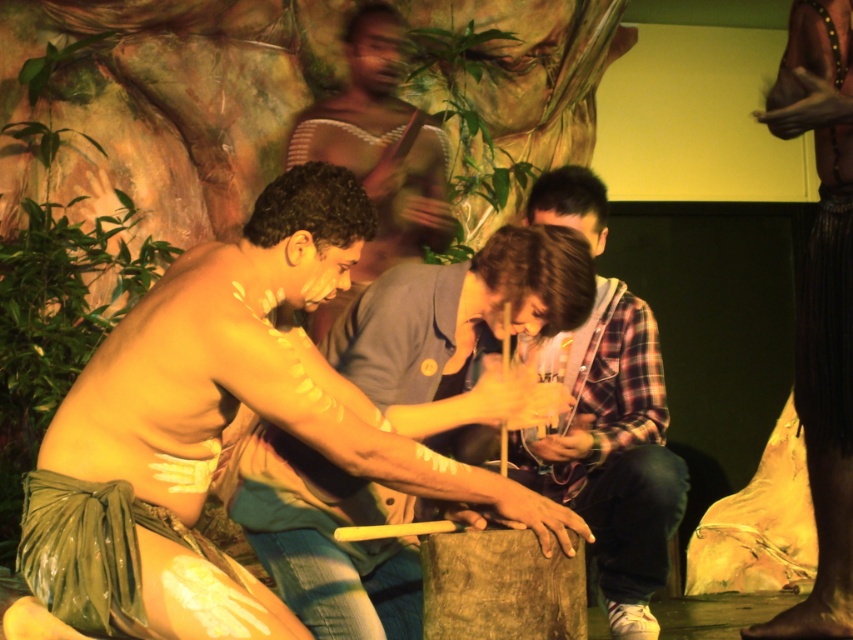
You are a visitor at this cultural exhibit and want to know which item takes up more space between the green textured cloth at center and the plaid shirt at center. Can you tell me?

The plaid shirt at center occupies more space than the green textured cloth at center.

You are a visitor at the museum and want to take a photo of the green textured cloth at center and the smooth skin man at center. Which object should you focus on first if you want to capture both in the same frame without moving your camera?

The green textured cloth at center is smaller than the smooth skin man at center, so you should focus on the smooth skin man at center first to ensure both fit in the frame.